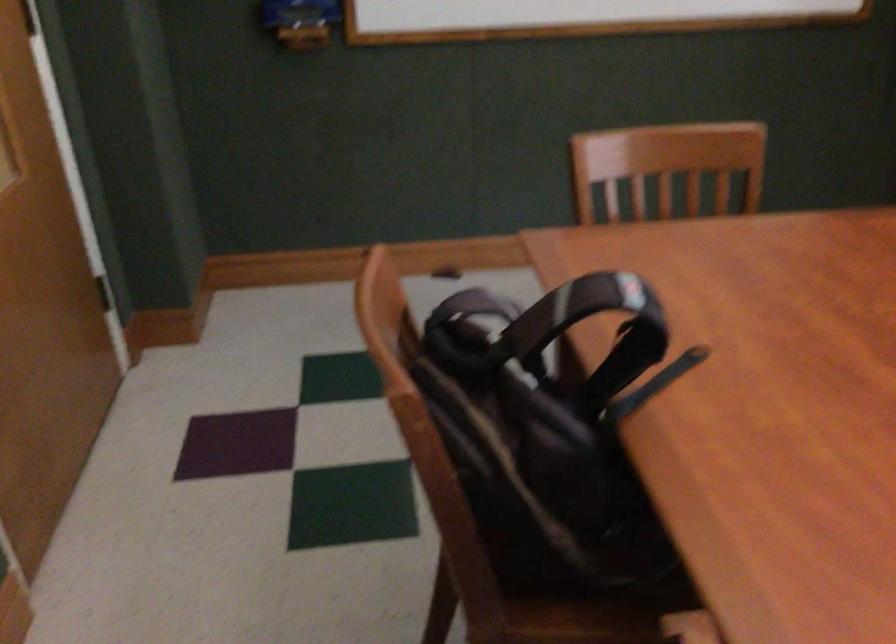
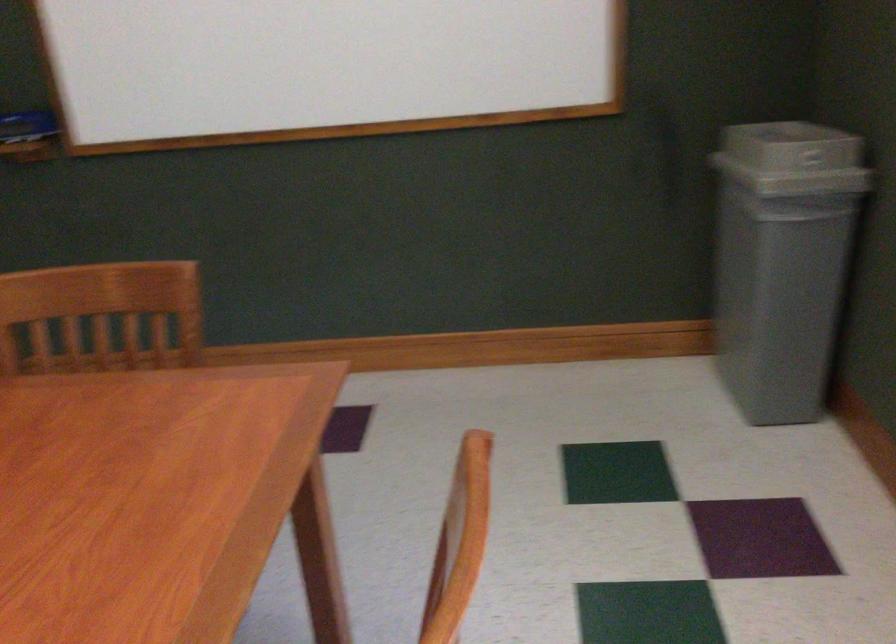
Question: The images are taken continuously from a first-person perspective. In which direction are you moving?

Choices:
 (A) Left
 (B) Right
 (C) Forward
 (D) Backward

Answer: (B)